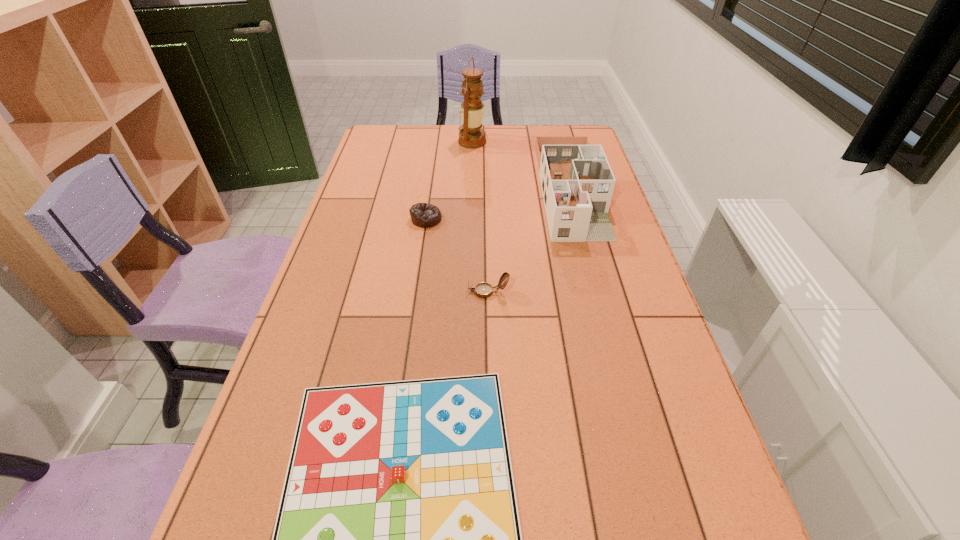
You are a GUI agent. You are given a task and a screenshot of the screen. Output one action in this format:
    pyautogui.click(x=<x>, y=<y>)
    Task: Click on the free space located on the face of the compass
    
    Given the screenshot: What is the action you would take?
    pyautogui.click(x=396, y=292)

Locate an element on the screen. free location located on the front of the beanbag is located at coordinates (420, 264).

Locate an element on the screen. Image resolution: width=960 pixels, height=540 pixels. oil lamp positioned at the far edge is located at coordinates (472, 110).

Locate an element on the screen. This screenshot has height=540, width=960. dollhouse present at the far edge is located at coordinates (577, 183).

Where is `object that is at the right edge`? This screenshot has height=540, width=960. object that is at the right edge is located at coordinates (577, 183).

At what (x,y) coordinates should I click in order to perform the action: click on object located at the far right corner. Please return your answer as a coordinate pair (x, y). Looking at the image, I should click on (577, 183).

This screenshot has width=960, height=540. What are the coordinates of `vacant space at the far edge of the desktop` in the screenshot? It's located at (513, 150).

I want to click on free space at the left edge of the desktop, so tap(322, 267).

Identify the location of vacant region at the right edge of the desktop. (664, 410).

In the image, there is a desktop. Identify the location of vacant space at the far left corner. The image size is (960, 540). (395, 152).